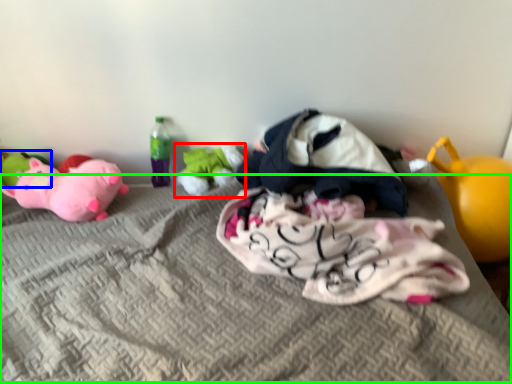
Question: Which object is the closest to the toy (highlighted by a red box)? Choose among these: toy (highlighted by a blue box) or mattress (highlighted by a green box).

Choices:
 (A) toy
 (B) mattress

Answer: (B)